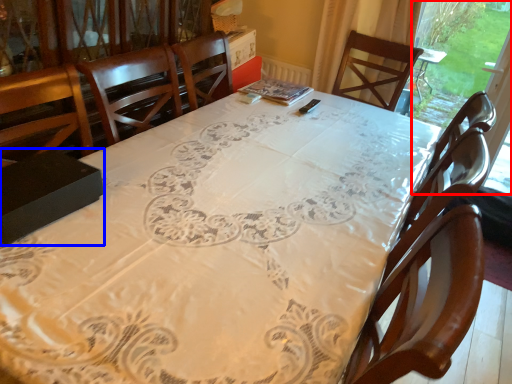
Question: Which object is closer to the camera taking this photo, window screen (highlighted by a red box) or box (highlighted by a blue box)?

Choices:
 (A) window screen
 (B) box

Answer: (B)